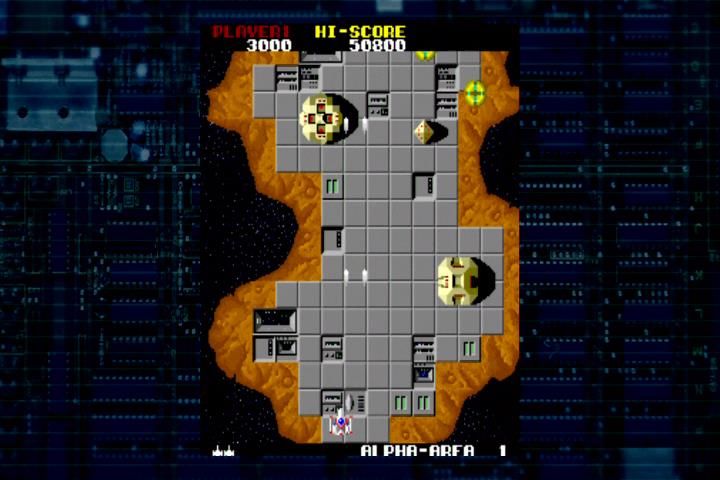
Identify the location of containers. (453, 276).